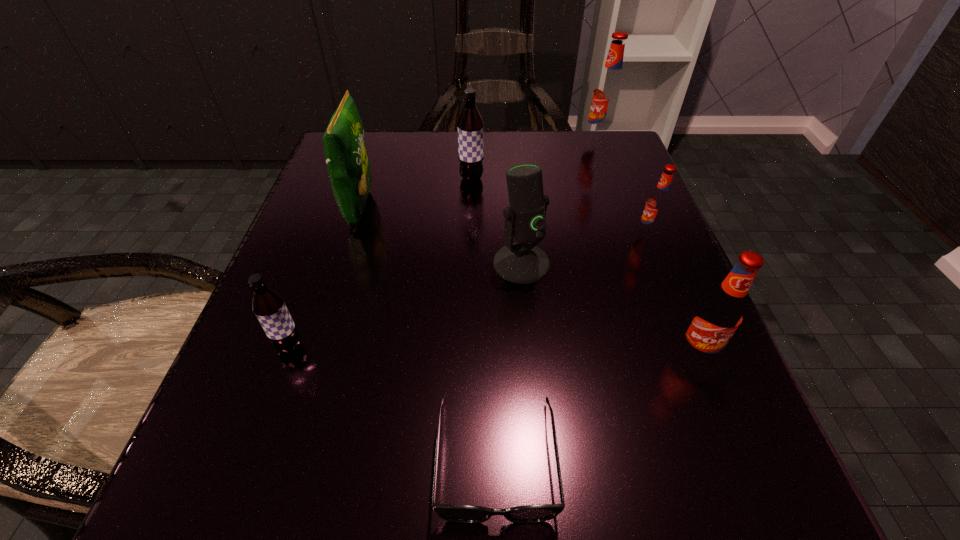
This screenshot has height=540, width=960. Find the location of `vacant region that satisfies the following two spatial constraints: 1. on the back side of the second farthest red root beer; 2. on the front-facing side of the green crisp (potato chip)`. vacant region that satisfies the following two spatial constraints: 1. on the back side of the second farthest red root beer; 2. on the front-facing side of the green crisp (potato chip) is located at coordinates (637, 208).

You are a GUI agent. You are given a task and a screenshot of the screen. Output one action in this format:
    pyautogui.click(x=<x>, y=<y>)
    Task: Click on the vacant space that satisfies the following two spatial constraints: 1. on the back side of the second biggest red root beer; 2. on the front-facing side of the crisp (potato chip)
    This screenshot has width=960, height=540.
    Given the screenshot: What is the action you would take?
    pyautogui.click(x=637, y=208)